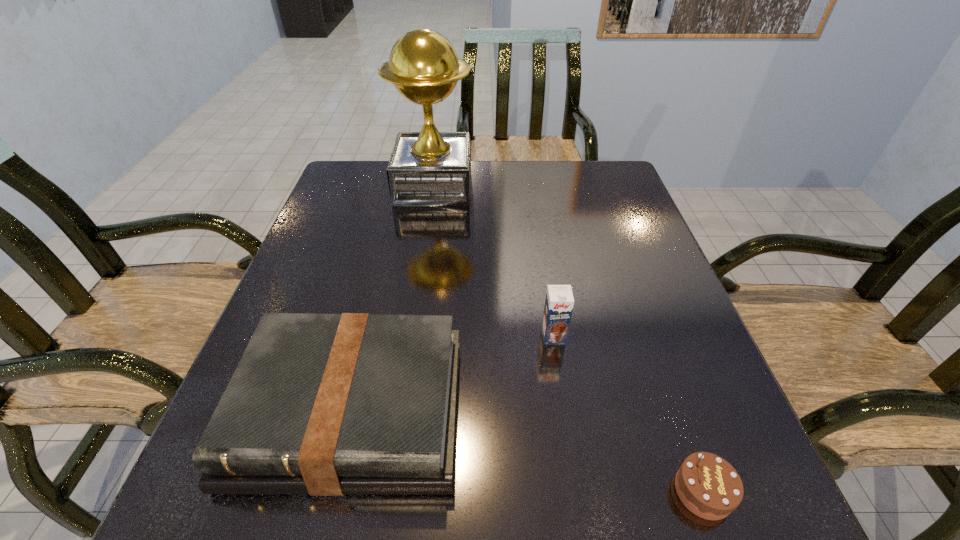
Where is `vacant region that satisfies the following two spatial constraints: 1. on the back side of the shortest object; 2. on the front-facing side of the farthest object`? vacant region that satisfies the following two spatial constraints: 1. on the back side of the shortest object; 2. on the front-facing side of the farthest object is located at coordinates (594, 186).